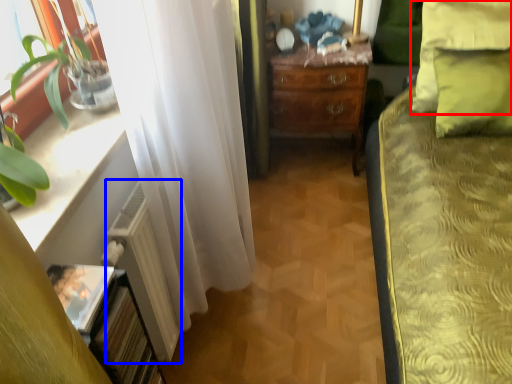
Question: Among these objects, which one is farthest to the camera, pillow (highlighted by a red box) or radiator (highlighted by a blue box)?

Choices:
 (A) pillow
 (B) radiator

Answer: (A)